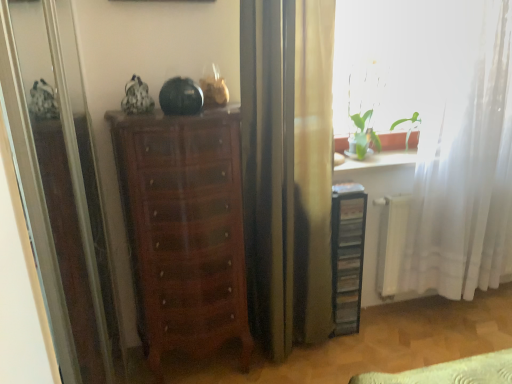
Identify the location of free area below white sheer curtain at right (from a real-world perspective). coord(459,318).